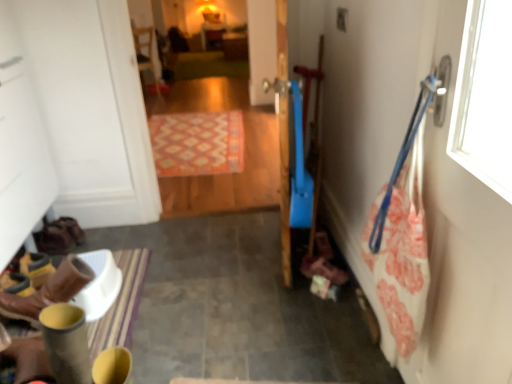
Question: Considering the relative positions of wooden chair at upper center and patterned carpet at center in the image provided, is wooden chair at upper center to the left or to the right of patterned carpet at center?

Choices:
 (A) right
 (B) left

Answer: (B)

Question: In terms of height, does wooden chair at upper center look taller or shorter compared to patterned carpet at center?

Choices:
 (A) short
 (B) tall

Answer: (B)

Question: Which of these objects is positioned closest to the brown leather boots at lower left?

Choices:
 (A) patterned carpet at center
 (B) wooden chair at upper center
 (C) patterned carpet at center

Answer: (C)

Question: Which of these objects is positioned farthest from the patterned carpet at center?

Choices:
 (A) patterned carpet at center
 (B) brown leather boots at lower left
 (C) wooden chair at upper center

Answer: (B)